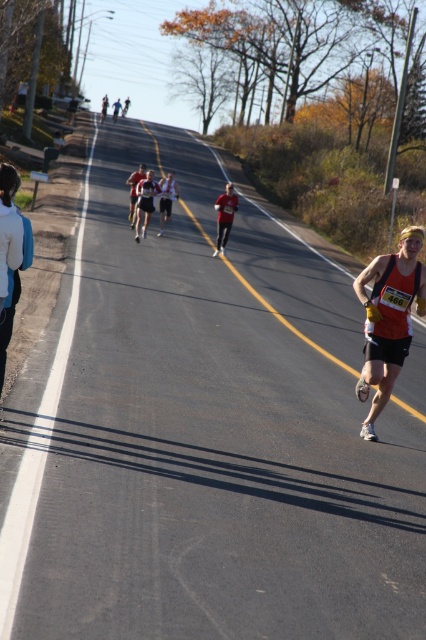
You are a runner participating in the marathon and currently at point (164,198). You need to reach point (385,400) as soon as possible. Which direction should you move relative to your current position?

You should move forward towards point (385,400) since it is in front of your current position at point (164,198).

You are a photographer standing at the starting line of the marathon. You want to capture a photo of the red fabric runner at center and the matte black tank top at right in the same frame. Based on their positions, which runner is closer to the right edge of the photo?

The matte black tank top at right is positioned on the right side of the red fabric runner at center, so it is closer to the right edge of the photo.

You are a photographer positioned at the starting line of the marathon. You notice two runners in the distance wearing a white fleece jacket at left and a matte black running suit at center. Which runner is closer to you based on their clothing size?

The white fleece jacket at left is larger in size than the matte black running suit at center, so the runner wearing the white fleece jacket at left is closer to you.